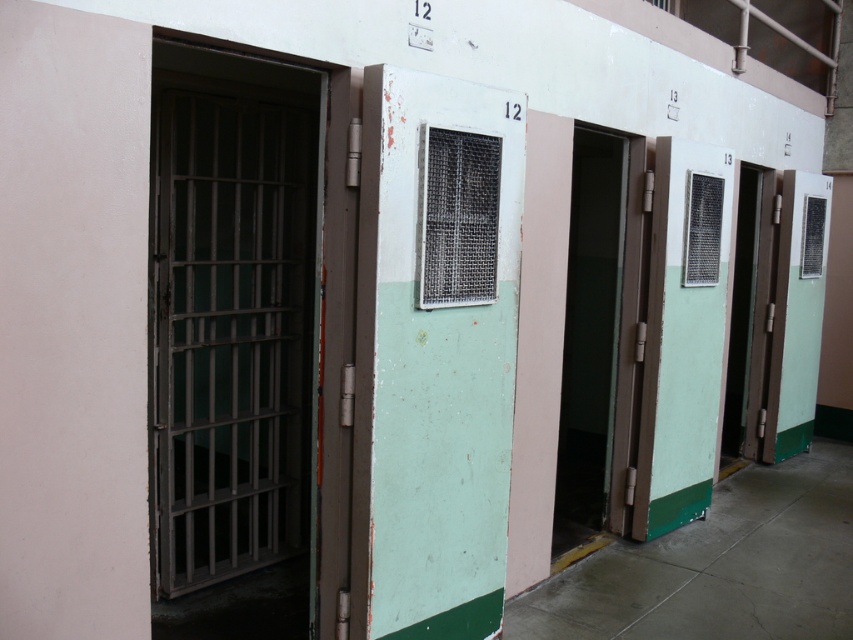
Question: Can you confirm if metallic gray bars at left is positioned to the right of green matte door at center?

Choices:
 (A) yes
 (B) no

Answer: (B)

Question: Which of the following is the farthest from the observer?

Choices:
 (A) green matte door at center
 (B) metallic gray bars at left

Answer: (A)

Question: Does metallic gray bars at left lie behind green matte door at center?

Choices:
 (A) yes
 (B) no

Answer: (B)

Question: Which point is closer to the camera?

Choices:
 (A) (254, 296)
 (B) (625, 156)

Answer: (A)

Question: Which of the following is the farthest from the observer?

Choices:
 (A) green matte door at center
 (B) metallic gray bars at left

Answer: (A)

Question: From the image, what is the correct spatial relationship of metallic gray bars at left in relation to green matte door at center?

Choices:
 (A) right
 (B) left

Answer: (B)